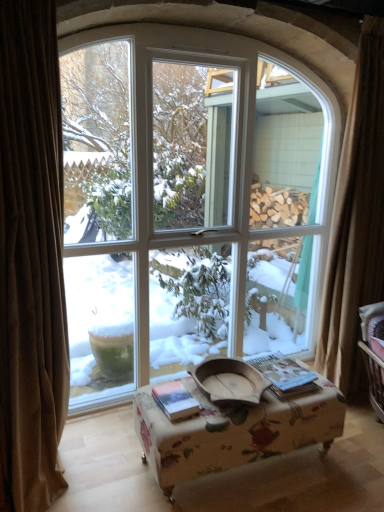
I want to click on free location above floral fabric ottoman at center (from a real-world perspective), so click(x=244, y=396).